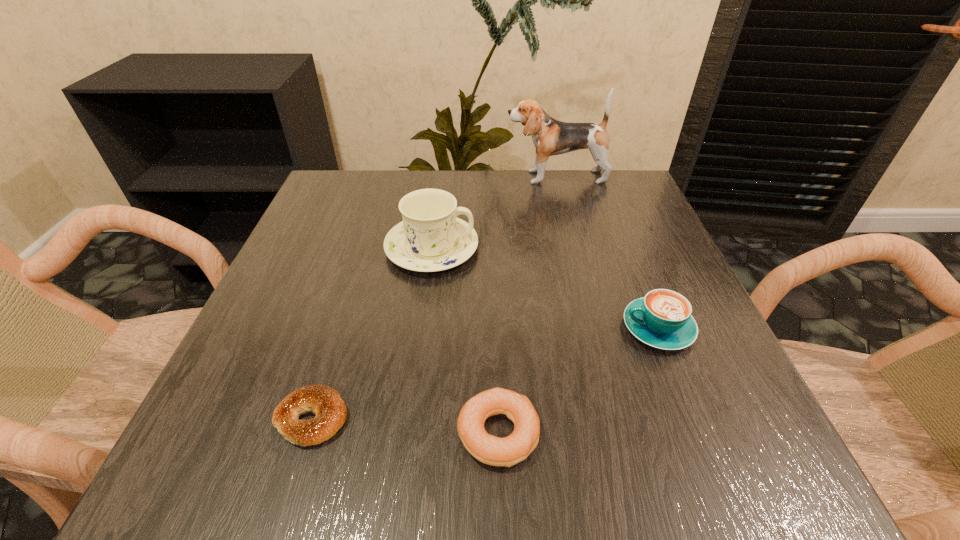
In the image, there is a desktop. Where is `free space at the far left corner`? This screenshot has width=960, height=540. free space at the far left corner is located at coordinates tap(352, 202).

In order to click on free spot at the near right corner of the desktop in this screenshot , I will do `click(727, 435)`.

Where is `vacant region between the right bagel and the third nearest object`? The height and width of the screenshot is (540, 960). vacant region between the right bagel and the third nearest object is located at coordinates (578, 380).

I want to click on unoccupied area between the shorter bagel and the cappuccino, so click(485, 373).

This screenshot has height=540, width=960. Identify the location of free space that is in between the taller bagel and the left bagel. 405,426.

Find the location of a particular element. The height and width of the screenshot is (540, 960). free space between the second shortest object and the puppy is located at coordinates (527, 305).

Where is `free space between the third shortest object and the chinaware`? The height and width of the screenshot is (540, 960). free space between the third shortest object and the chinaware is located at coordinates (545, 288).

The height and width of the screenshot is (540, 960). I want to click on empty location between the tallest object and the left bagel, so click(x=434, y=298).

At what (x,y) coordinates should I click in order to perform the action: click on vacant point located between the second tallest object and the taller bagel. Please return your answer as a coordinate pair (x, y). The image size is (960, 540). Looking at the image, I should click on (465, 340).

This screenshot has height=540, width=960. I want to click on unoccupied position between the second shortest object and the shortest object, so click(405, 426).